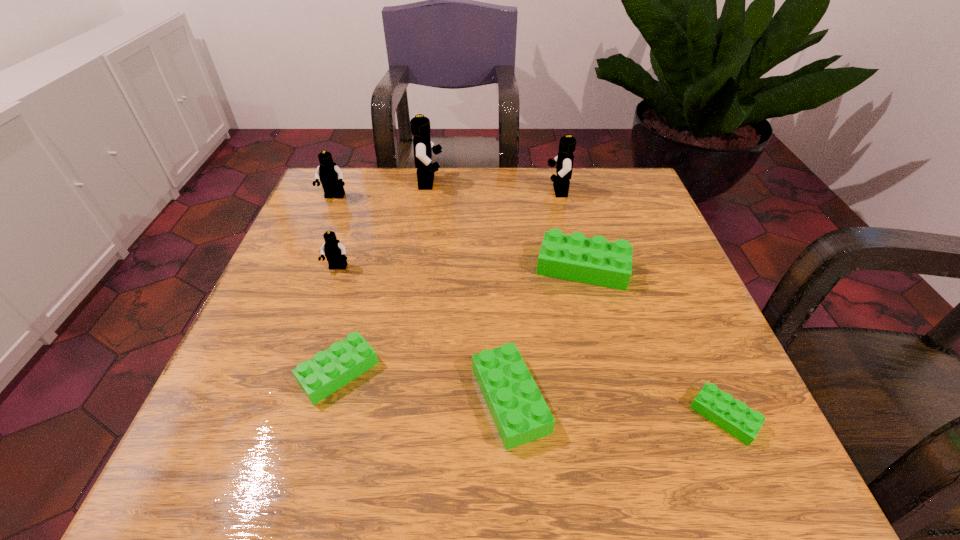
You are a GUI agent. You are given a task and a screenshot of the screen. Output one action in this format:
    pyautogui.click(x=<x>, y=<y>)
    Task: Click on the tallest Lego
    This screenshot has width=960, height=540.
    Given the screenshot: What is the action you would take?
    pyautogui.click(x=420, y=125)

Where is `the fifth Lego from right to left`? the fifth Lego from right to left is located at coordinates (420, 125).

Locate an element on the screen. The height and width of the screenshot is (540, 960). the second tallest Lego is located at coordinates (564, 166).

Find the location of a particular element. The image size is (960, 540). the seventh shortest object is located at coordinates (564, 166).

The width and height of the screenshot is (960, 540). I want to click on the sixth shortest object, so click(x=331, y=176).

This screenshot has width=960, height=540. I want to click on the leftmost black Lego, so click(x=331, y=176).

This screenshot has width=960, height=540. What are the coordinates of `the fifth shortest object` in the screenshot? It's located at coord(334,251).

This screenshot has width=960, height=540. Find the location of `the smallest black Lego`. the smallest black Lego is located at coordinates (334, 251).

Identify the location of the fifth tallest object. This screenshot has height=540, width=960. (595, 261).

Image resolution: width=960 pixels, height=540 pixels. What are the coordinates of `the farthest green Lego` in the screenshot? It's located at (595, 261).